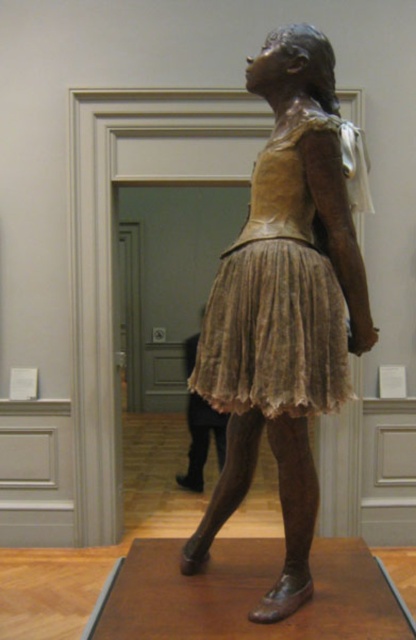
You are standing in front of the bronze sculpture of the ballerina. You want to place a small decorative item exactly at the point with coordinates point (371, 324). If you are 2 meters away from the sculpture, will you be able to reach the point without moving closer?

The distance of point (371, 324) from camera is 1.69 meters. Since you are currently 2 meters away from the sculpture, you are farther than the required distance to reach the point. Therefore, you need to move closer to 1.69 meters to place the item.

You are an art student analyzing the sculpture. You notice two points on the sculpture at coordinates point (282, 346) and point (277, 356). Which point is closer to the camera?

Point (282, 346) is further to the camera than point (277, 356), so the point closer to the camera is point (277, 356).

You are an art student who just entered the museum and want to sketch the bronze textured sculpture at center. Where should you stand to get the best view of it?

The bronze textured sculpture at center is located at point (x=284, y=307), so standing directly in front of that point would provide the best view for sketching.